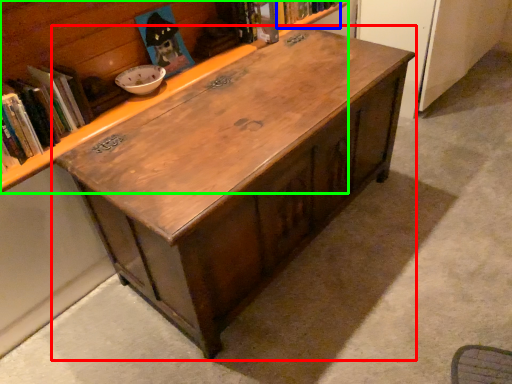
Question: Estimate the real-world distances between objects in this image. Which object is farther from table (highlighted by a red box), book (highlighted by a blue box) or bookcase (highlighted by a green box)?

Choices:
 (A) book
 (B) bookcase

Answer: (A)